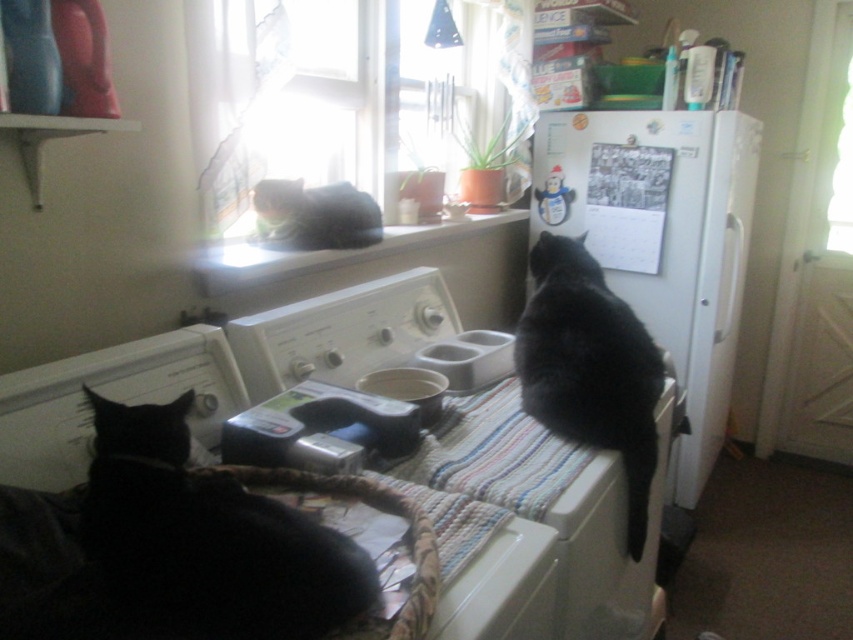
You are a photographer trying to capture both cats in a single shot. Given that your camera can only focus on objects within a 1.2 meter width, can you fit both the black fur cat at lower left and the black fur cat at upper center into the frame without moving the camera?

The black fur cat at lower left might be wider than black fur cat at upper center. However, since the camera can focus on objects within a 1.2 meter width, and without knowing the exact width of either cat, it is uncertain if both will fit. The photographer should check the actual width of the cats to ensure they fit within the 1.2 meter limit.

You are a cat owner who wants to ensure both cats can see each other while resting. Given the layout of the kitchen, can the black fur cat at lower left and the black fur cat at upper center see each other?

The black fur cat at lower left is located below the black fur cat at upper center, so they can see each other as their positions allow for a clear line of sight between them.

You are a cat owner who wants to ensure both cats can see each other. Given their positions, can the black fur cat at lower left and the black fur cat at upper center see each other clearly?

The black fur cat at lower left is closer to the viewer than the black fur cat at upper center, so they are positioned at different depths. This means they can likely see each other as long as their line of sight isn